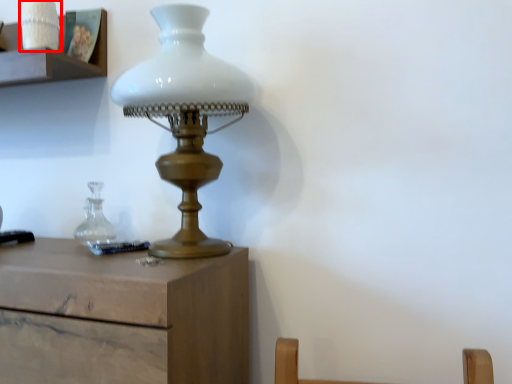
Question: Where is candle holder (annotated by the red box) located in relation to lamp in the image?

Choices:
 (A) left
 (B) right

Answer: (A)